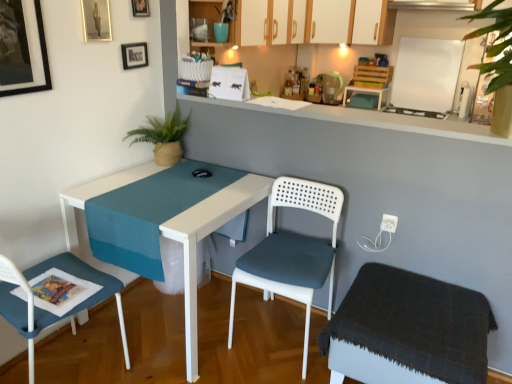
Image resolution: width=512 pixels, height=384 pixels. What are the coordinates of `vacant region below blue fabric chair at lower left, the second chair from the right (from a real-world perspective)` in the screenshot? It's located at (82, 366).